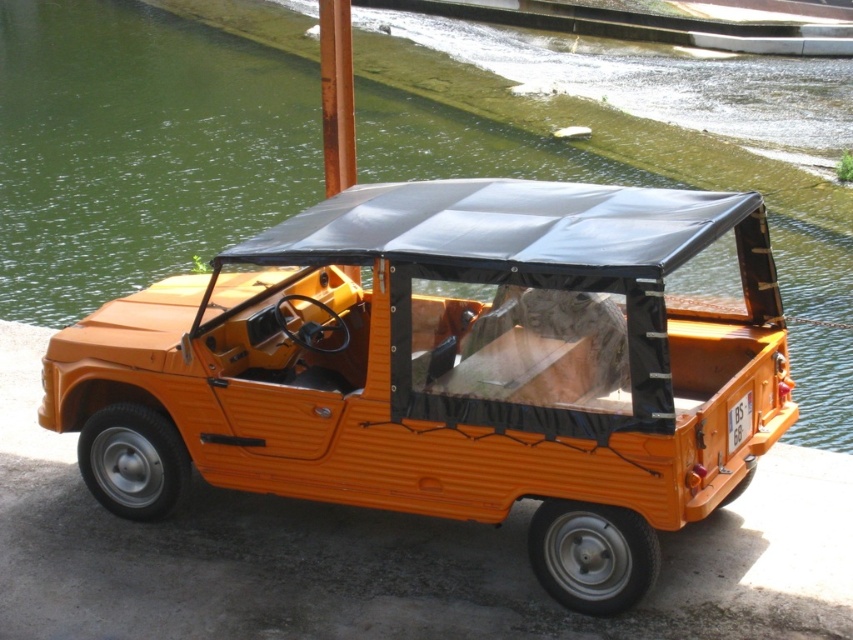
From the picture: You are standing at the origin point of the image coordinate system. Where is the orange matte car at center located in terms of coordinates?

The orange matte car at center is located at coordinates point (x=448, y=371).

You are a photographer planning to take a wide shot of the orange matte car at center and the green water at center. Which object will appear smaller in the photo?

The orange matte car at center will appear smaller in the photo because it has a smaller size compared to the green water at center.